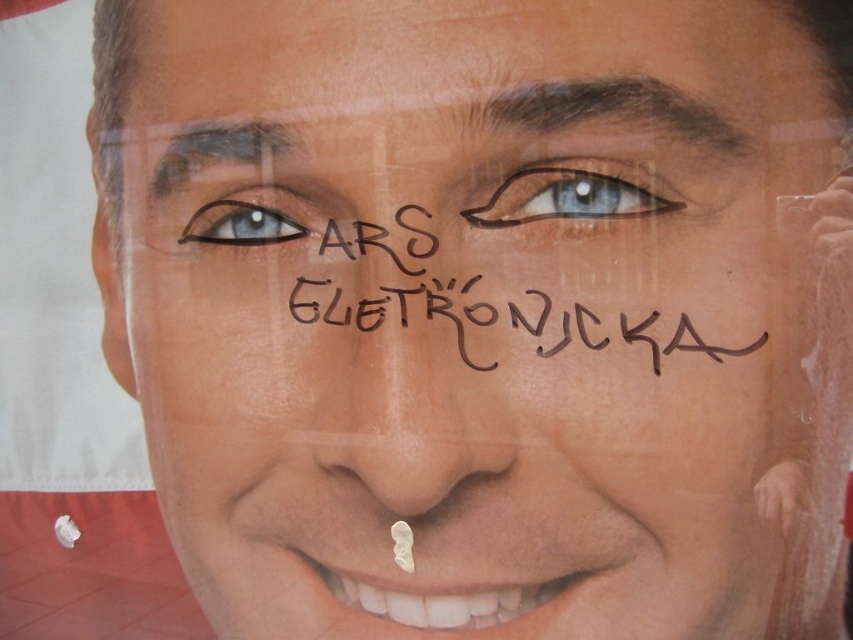
Looking at this image, who is more forward, (672,202) or (288,230)?

Point (672,202) is more forward.

Can you confirm if blue matte eye at upper center is bigger than matte blue eye at upper left?

Yes, blue matte eye at upper center is bigger than matte blue eye at upper left.

The width and height of the screenshot is (853, 640). What do you see at coordinates (566, 196) in the screenshot? I see `blue matte eye at upper center` at bounding box center [566, 196].

This screenshot has width=853, height=640. In order to click on blue matte eye at upper center in this screenshot , I will do `click(566, 196)`.

Between black ink writing at center and matte blue eye at upper left, which one is positioned lower?

black ink writing at center is lower down.

Is black ink writing at center to the left of matte blue eye at upper left from the viewer's perspective?

In fact, black ink writing at center is to the right of matte blue eye at upper left.

You are a GUI agent. You are given a task and a screenshot of the screen. Output one action in this format:
    pyautogui.click(x=<x>, y=<y>)
    Task: Click on the black ink writing at center
    The height and width of the screenshot is (640, 853).
    Given the screenshot: What is the action you would take?
    pyautogui.click(x=485, y=301)

Locate an element on the screen. Image resolution: width=853 pixels, height=640 pixels. black ink writing at center is located at coordinates (485, 301).

Is black ink writing at center bigger than blue matte eye at upper center?

Indeed, black ink writing at center has a larger size compared to blue matte eye at upper center.

Consider the image. Can you confirm if black ink writing at center is shorter than blue matte eye at upper center?

In fact, black ink writing at center may be taller than blue matte eye at upper center.

You are a GUI agent. You are given a task and a screenshot of the screen. Output one action in this format:
    pyautogui.click(x=<x>, y=<y>)
    Task: Click on the black ink writing at center
    
    Given the screenshot: What is the action you would take?
    pyautogui.click(x=485, y=301)